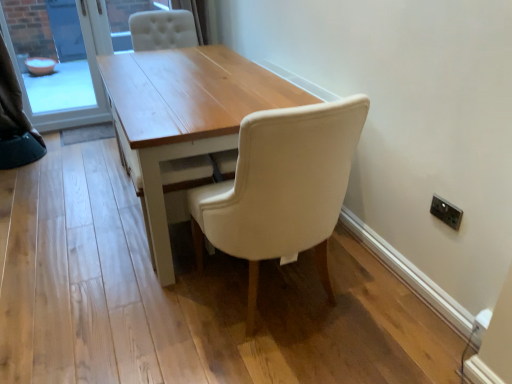
Question: From a real-world perspective, is matte white chair at center below white fabric curtain at upper left?

Choices:
 (A) no
 (B) yes

Answer: (B)

Question: Are matte white chair at center and white fabric curtain at upper left located far from each other?

Choices:
 (A) yes
 (B) no

Answer: (A)

Question: Is matte white chair at center taller than white fabric curtain at upper left?

Choices:
 (A) no
 (B) yes

Answer: (B)

Question: Considering the relative sizes of matte white chair at center and white fabric curtain at upper left in the image provided, is matte white chair at center shorter than white fabric curtain at upper left?

Choices:
 (A) yes
 (B) no

Answer: (B)

Question: From a real-world perspective, does matte white chair at center stand above white fabric curtain at upper left?

Choices:
 (A) yes
 (B) no

Answer: (B)

Question: Would you say matte white chair at center contains white fabric curtain at upper left?

Choices:
 (A) no
 (B) yes

Answer: (A)

Question: From a real-world perspective, is matte white chair at center located higher than light wood table at center?

Choices:
 (A) yes
 (B) no

Answer: (A)

Question: Considering the relative sizes of matte white chair at center and light wood table at center in the image provided, is matte white chair at center bigger than light wood table at center?

Choices:
 (A) yes
 (B) no

Answer: (B)

Question: Is the position of matte white chair at center more distant than that of light wood table at center?

Choices:
 (A) yes
 (B) no

Answer: (B)

Question: Does matte white chair at center have a smaller size compared to light wood table at center?

Choices:
 (A) no
 (B) yes

Answer: (B)

Question: Is matte white chair at center completely or partially outside of light wood table at center?

Choices:
 (A) no
 (B) yes

Answer: (B)

Question: Is matte white chair at center thinner than light wood table at center?

Choices:
 (A) yes
 (B) no

Answer: (A)

Question: From the image's perspective, is matte glass bowl at left located beneath light wood table at center?

Choices:
 (A) yes
 (B) no

Answer: (B)